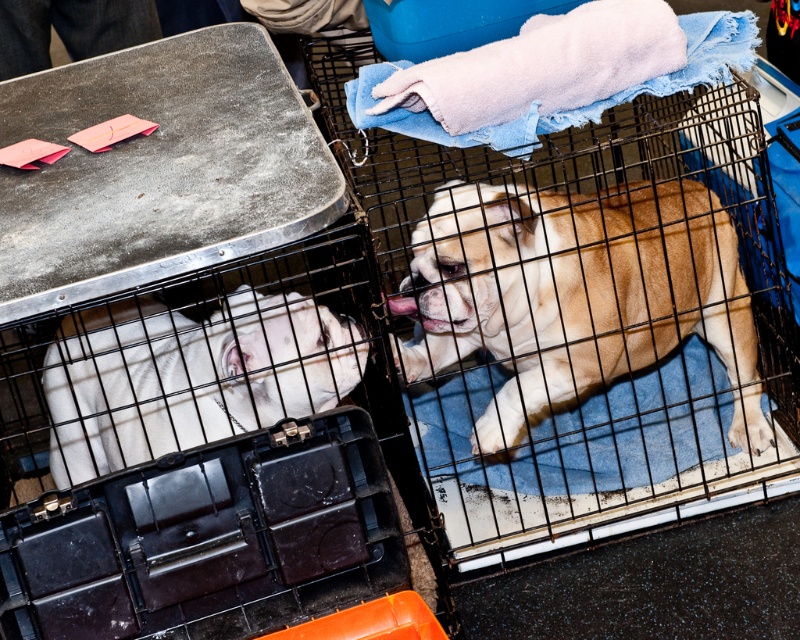
Does light brown fur at center lie in front of white smooth dog at left?

No, light brown fur at center is behind white smooth dog at left.

Does point (684, 237) come farther from viewer compared to point (74, 355)?

Yes, point (684, 237) is farther from viewer.

Locate an element on the screen. The image size is (800, 640). light brown fur at center is located at coordinates (576, 296).